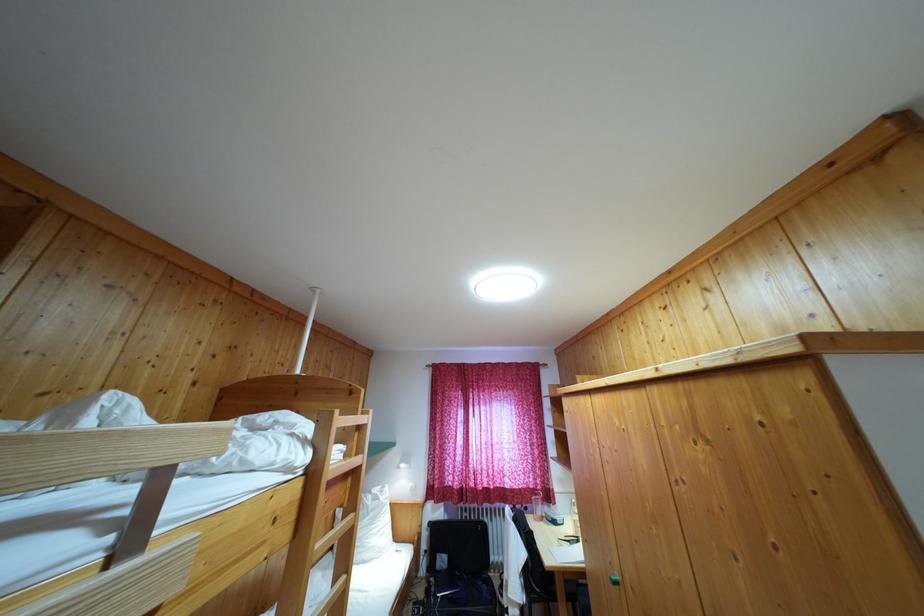
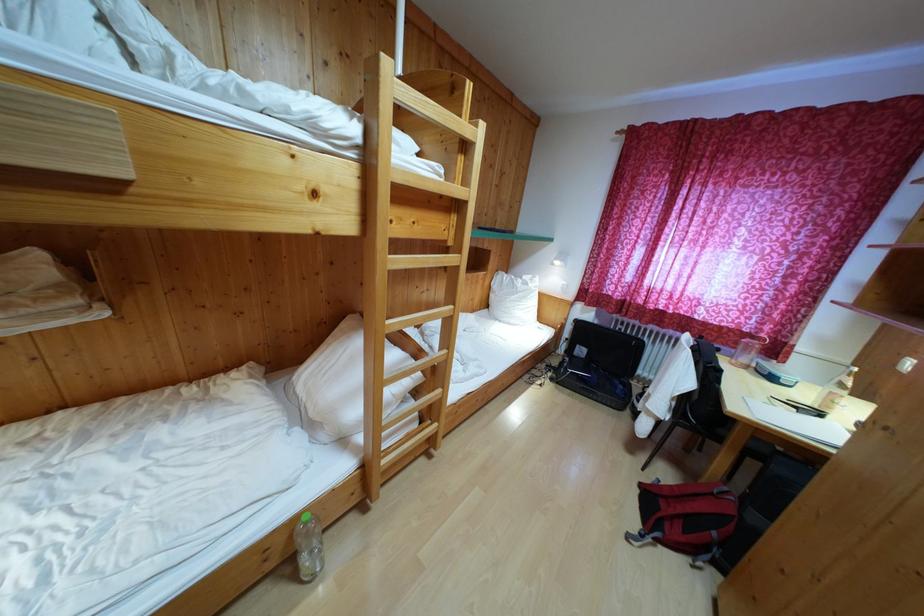
Based on the continuous images, in which direction is the camera rotating?

The rotation direction of the camera is left-down.